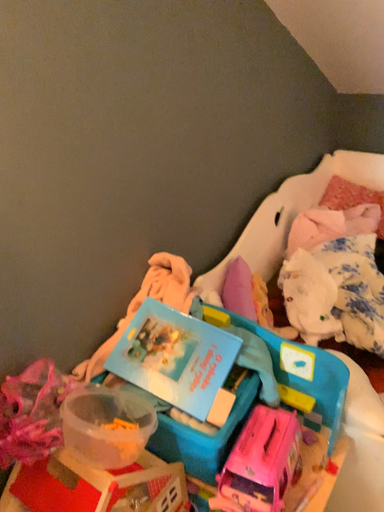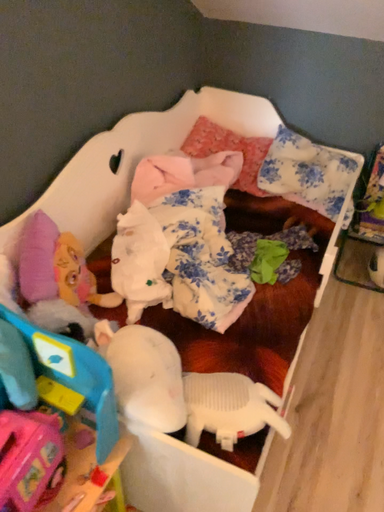
Question: Which way did the camera rotate in the video?

Choices:
 (A) rotated left
 (B) rotated right

Answer: (B)